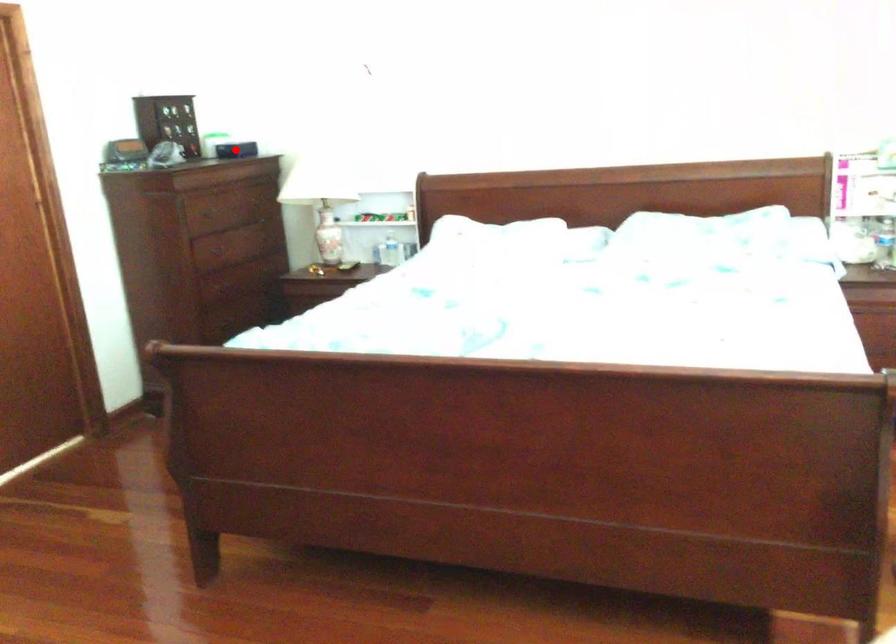
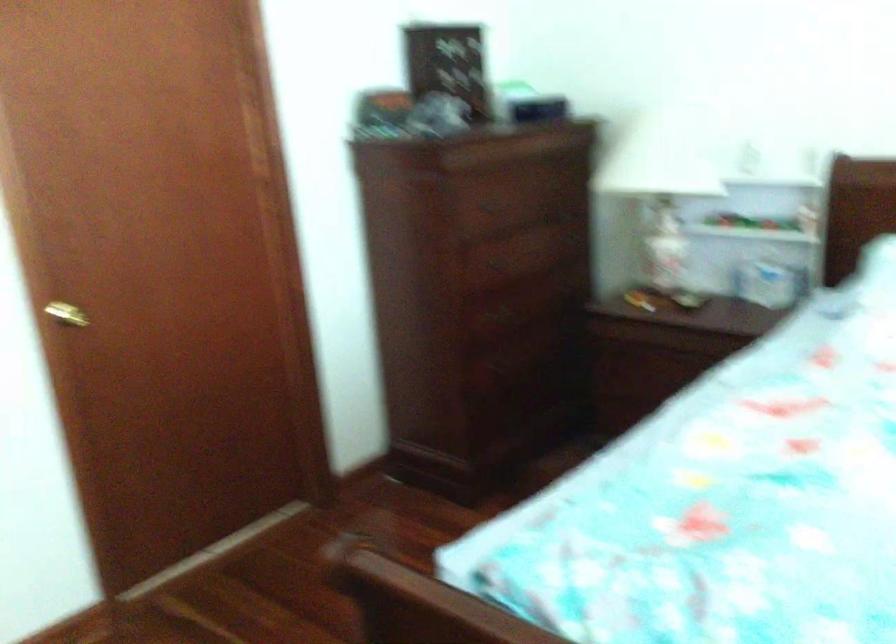
Question: I am providing you with two images of the same scene from different viewpoints. A red point is marked on the first image. Is the red point's position out of view in image 2?

Choices:
 (A) Yes
 (B) No

Answer: (A)